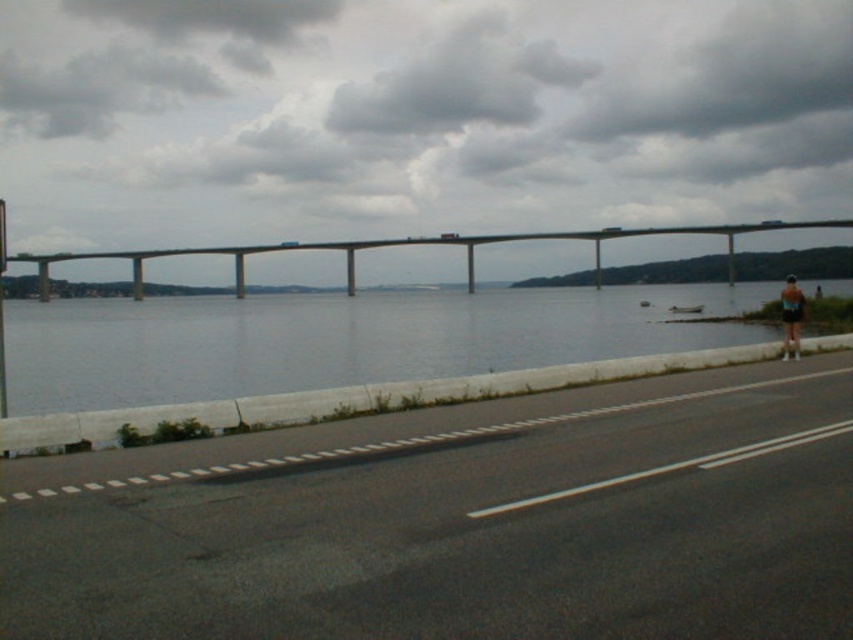
Question: Does smooth concrete water at center have a greater width compared to black matte shorts at right?

Choices:
 (A) no
 (B) yes

Answer: (B)

Question: Estimate the real-world distances between objects in this image. Which object is farther from the smooth concrete water at center?

Choices:
 (A) metallic street sign at left
 (B) concrete bridge at center
 (C) black asphalt highway at center

Answer: (A)

Question: Which object appears closest to the camera in this image?

Choices:
 (A) smooth concrete water at center
 (B) black asphalt highway at center
 (C) metallic street sign at left

Answer: (B)

Question: Which of these objects is positioned farthest from the black matte shorts at right?

Choices:
 (A) black asphalt highway at center
 (B) smooth concrete water at center
 (C) metallic street sign at left
 (D) concrete bridge at center

Answer: (C)

Question: Is smooth concrete water at center below concrete bridge at center?

Choices:
 (A) yes
 (B) no

Answer: (A)

Question: Where is black asphalt highway at center located in relation to smooth concrete water at center in the image?

Choices:
 (A) left
 (B) right

Answer: (B)